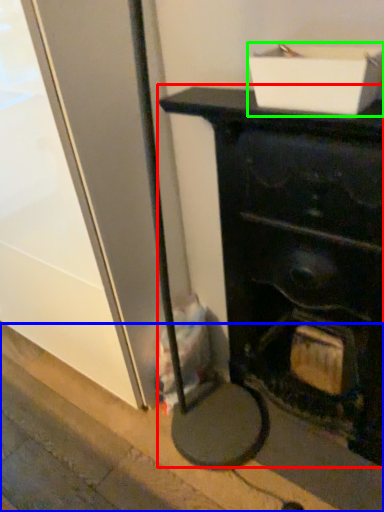
Question: Which object is positioned farthest from furniture (highlighted by a red box)? Select from pavement (highlighted by a blue box) and cardboard box (highlighted by a green box).

Choices:
 (A) pavement
 (B) cardboard box

Answer: (A)